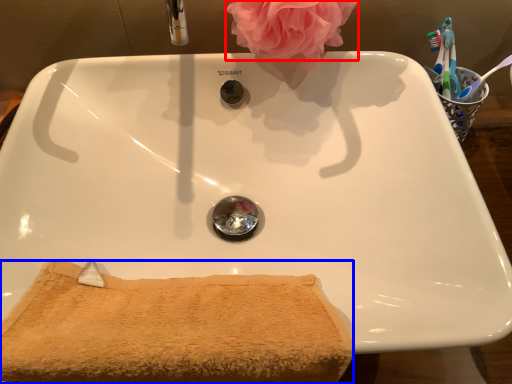
Question: Which object appears closest to the camera in this image, rose (highlighted by a red box) or bath towel (highlighted by a blue box)?

Choices:
 (A) rose
 (B) bath towel

Answer: (B)